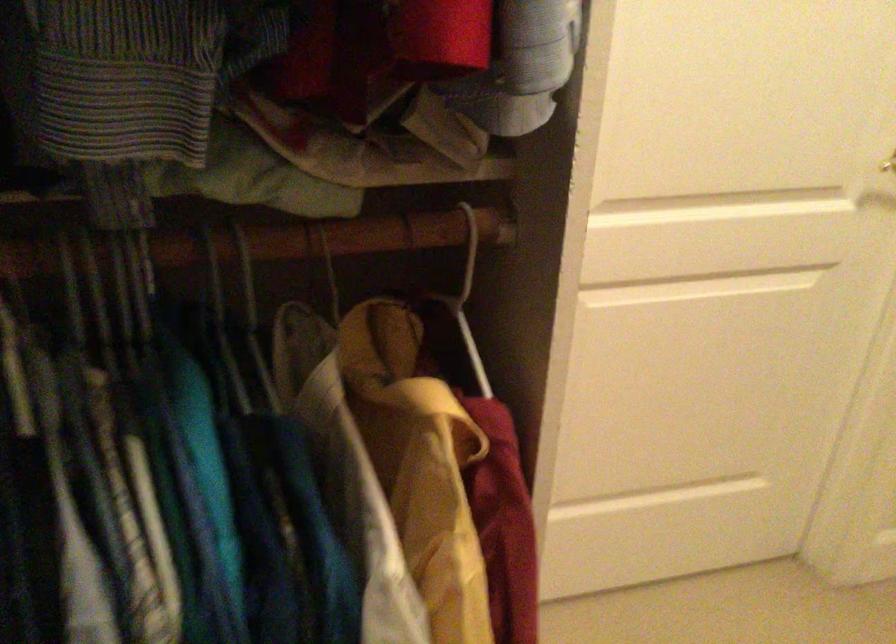
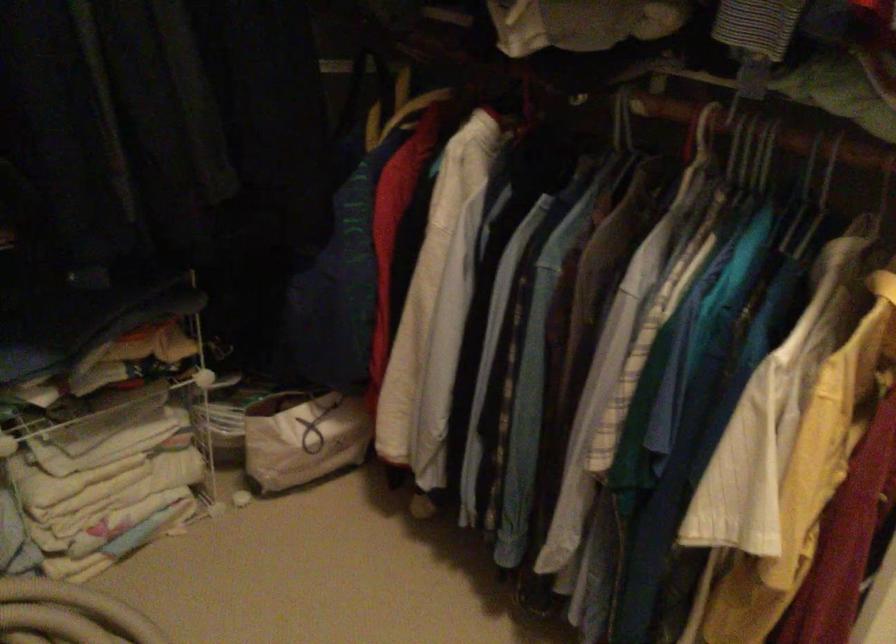
Locate, in the second image, the point that corresponds to [143,281] in the first image.

(767, 154)